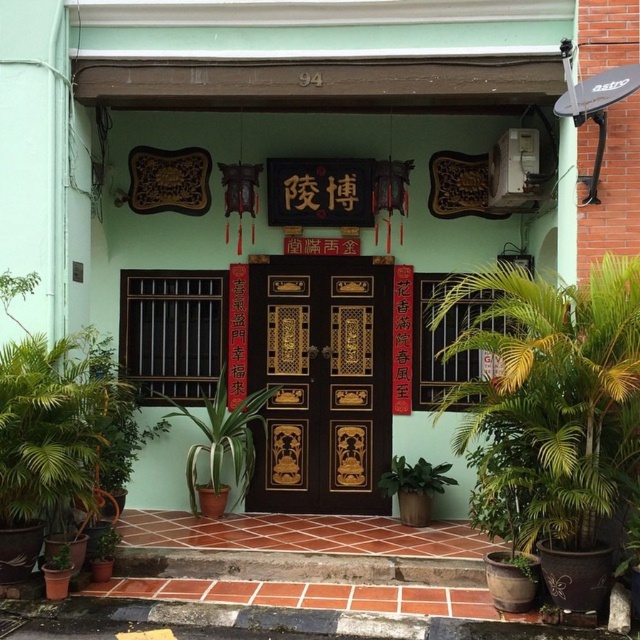
Question: Which of these objects is positioned closest to the green leafy plant at right?

Choices:
 (A) green glossy plant at lower right
 (B) glossy wood door at center
 (C) green matte plant at center
 (D) green matte plant at lower left

Answer: (A)

Question: Which object is positioned farthest from the green matte plant at lower left?

Choices:
 (A) green matte plant at center
 (B) green glossy plant at lower right

Answer: (B)

Question: Is green leafy plant at right positioned at the back of green glossy plant at lower right?

Choices:
 (A) no
 (B) yes

Answer: (A)

Question: Which point is farther to the camera?

Choices:
 (A) (605, 348)
 (B) (115, 529)

Answer: (B)

Question: Does green leafy plant at right appear over glossy wood door at center?

Choices:
 (A) yes
 (B) no

Answer: (B)

Question: Is glossy wood door at center closer to camera compared to green leafy plant at lower left?

Choices:
 (A) no
 (B) yes

Answer: (A)